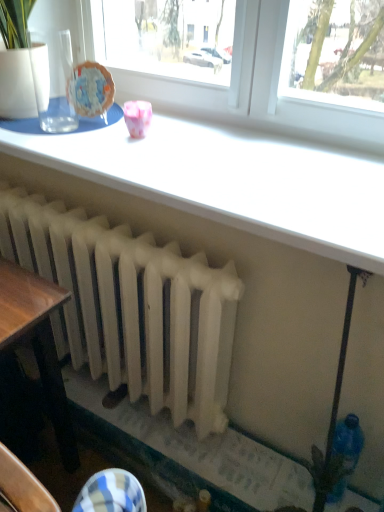
Question: Is pink glossy cup at upper center wider than white matte radiator at center?

Choices:
 (A) yes
 (B) no

Answer: (B)

Question: Can you confirm if pink glossy cup at upper center is taller than white matte radiator at center?

Choices:
 (A) no
 (B) yes

Answer: (A)

Question: Is pink glossy cup at upper center positioned beyond the bounds of white matte radiator at center?

Choices:
 (A) yes
 (B) no

Answer: (A)

Question: Is pink glossy cup at upper center facing towards white matte radiator at center?

Choices:
 (A) no
 (B) yes

Answer: (A)

Question: From the image's perspective, does pink glossy cup at upper center appear lower than white matte radiator at center?

Choices:
 (A) yes
 (B) no

Answer: (B)

Question: In terms of width, does white glossy table at upper center look wider or thinner when compared to white matte radiator at center?

Choices:
 (A) wide
 (B) thin

Answer: (A)

Question: From the image's perspective, relative to white matte radiator at center, is white glossy table at upper center above or below?

Choices:
 (A) above
 (B) below

Answer: (A)

Question: Is white glossy table at upper center in front of or behind white matte radiator at center in the image?

Choices:
 (A) front
 (B) behind

Answer: (A)

Question: Would you say white glossy table at upper center is to the left or to the right of white matte radiator at center in the picture?

Choices:
 (A) right
 (B) left

Answer: (A)

Question: From the image's perspective, is pink glossy cup at upper center positioned above or below white glossy table at upper center?

Choices:
 (A) above
 (B) below

Answer: (A)

Question: Which is correct: pink glossy cup at upper center is inside white glossy table at upper center, or outside of it?

Choices:
 (A) inside
 (B) outside

Answer: (B)

Question: From a real-world perspective, is pink glossy cup at upper center positioned above or below white glossy table at upper center?

Choices:
 (A) below
 (B) above

Answer: (B)

Question: Considering the positions of point (135, 104) and point (314, 222), is point (135, 104) closer or farther from the camera than point (314, 222)?

Choices:
 (A) farther
 (B) closer

Answer: (A)

Question: In the image, is white glossy table at upper center on the left side or the right side of pink glossy cup at upper center?

Choices:
 (A) left
 (B) right

Answer: (B)

Question: Considering their positions, is white glossy table at upper center located in front of or behind pink glossy cup at upper center?

Choices:
 (A) behind
 (B) front

Answer: (B)